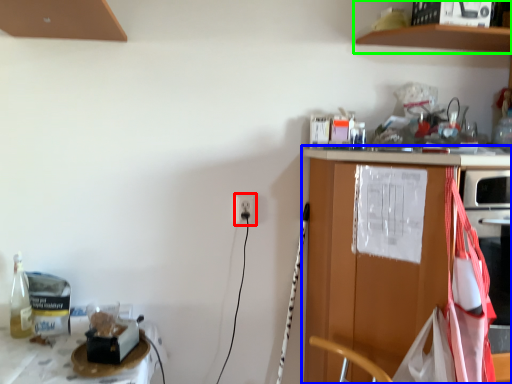
Question: Which is nearer to the electric outlet (highlighted by a red box)? countertop (highlighted by a blue box) or shelf (highlighted by a green box).

Choices:
 (A) countertop
 (B) shelf

Answer: (A)